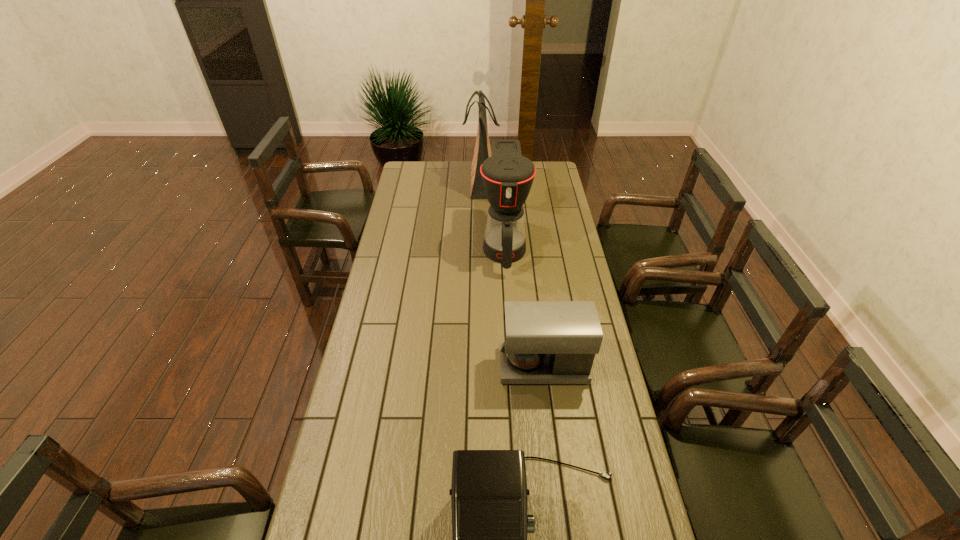
The height and width of the screenshot is (540, 960). Identify the location of vacant area situated on the carafe side of the third farthest object. (455, 366).

You are a GUI agent. You are given a task and a screenshot of the screen. Output one action in this format:
    pyautogui.click(x=<x>, y=<y>)
    Task: Click on the object positioned at the far edge
    
    Given the screenshot: What is the action you would take?
    pyautogui.click(x=482, y=151)

What are the coordinates of `object located at the right edge` in the screenshot? It's located at (545, 342).

Image resolution: width=960 pixels, height=540 pixels. I want to click on vacant space at the left edge of the desktop, so click(x=416, y=192).

I want to click on vacant space at the right edge of the desktop, so click(561, 281).

You are a GUI agent. You are given a task and a screenshot of the screen. Output one action in this format:
    pyautogui.click(x=<x>, y=<y>)
    Task: Click on the vacant space at the far left corner of the desktop
    Image resolution: width=960 pixels, height=540 pixels.
    Given the screenshot: What is the action you would take?
    pyautogui.click(x=418, y=171)

The width and height of the screenshot is (960, 540). In order to click on free space between the second nearest coffee maker and the shopping bag in this screenshot , I will do `click(513, 274)`.

The image size is (960, 540). Find the location of `vacant space that's between the second nearest coffee maker and the shopping bag`. vacant space that's between the second nearest coffee maker and the shopping bag is located at coordinates (513, 274).

Locate which object ranks in proximity to the nearest object. Please provide its 2D coordinates. Your answer should be formatted as a tuple, i.e. [(x, y)], where the tuple contains the x and y coordinates of a point satisfying the conditions above.

[(545, 342)]

Select which object is the third closest to the second nearest coffee maker. Please provide its 2D coordinates. Your answer should be formatted as a tuple, i.e. [(x, y)], where the tuple contains the x and y coordinates of a point satisfying the conditions above.

[(482, 151)]